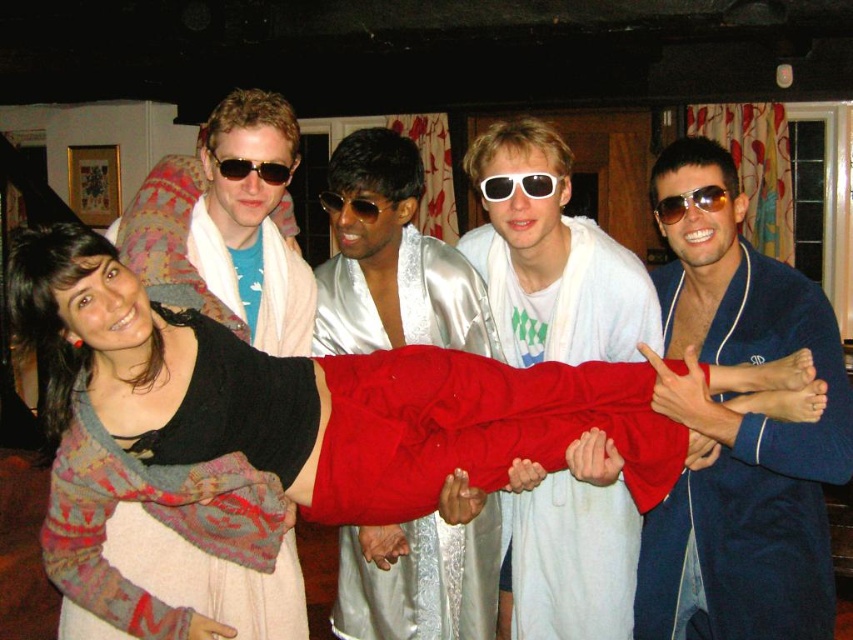
You are a photographer trying to capture a candid shot of the black reflective sunglasses at center and the blue satin robe at right. Since the sunglasses are reflecting light, you want to position your camera so that the robe doesn not block the view of the sunglasses. Is this possible based on their positions?

The blue satin robe at right is taller than the black reflective sunglasses at center, so it might block the view. To avoid blocking, position the camera lower so that you can see under the robe or move to the side where the robe is not directly in front of the sunglasses.